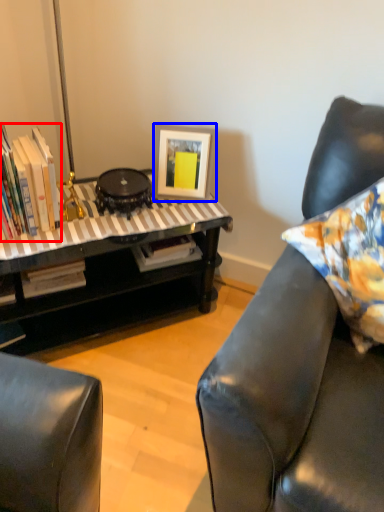
Question: Among these objects, which one is nearest to the camera, book (highlighted by a red box) or picture frame (highlighted by a blue box)?

Choices:
 (A) book
 (B) picture frame

Answer: (A)